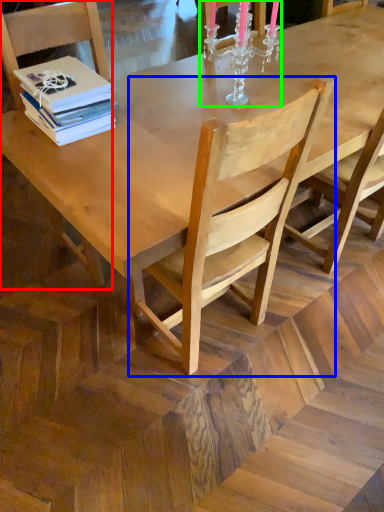
Question: Estimate the real-world distances between objects in this image. Which object is closer to chair (highlighted by a red box), chair (highlighted by a blue box) or candle holder (highlighted by a green box)?

Choices:
 (A) chair
 (B) candle holder

Answer: (B)